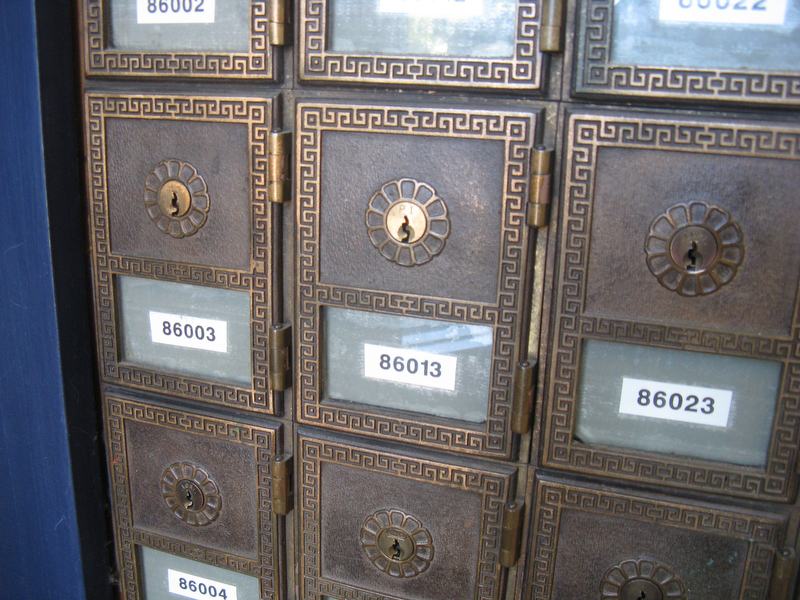
Where is `corner`? This screenshot has width=800, height=600. corner is located at coordinates (62, 391).